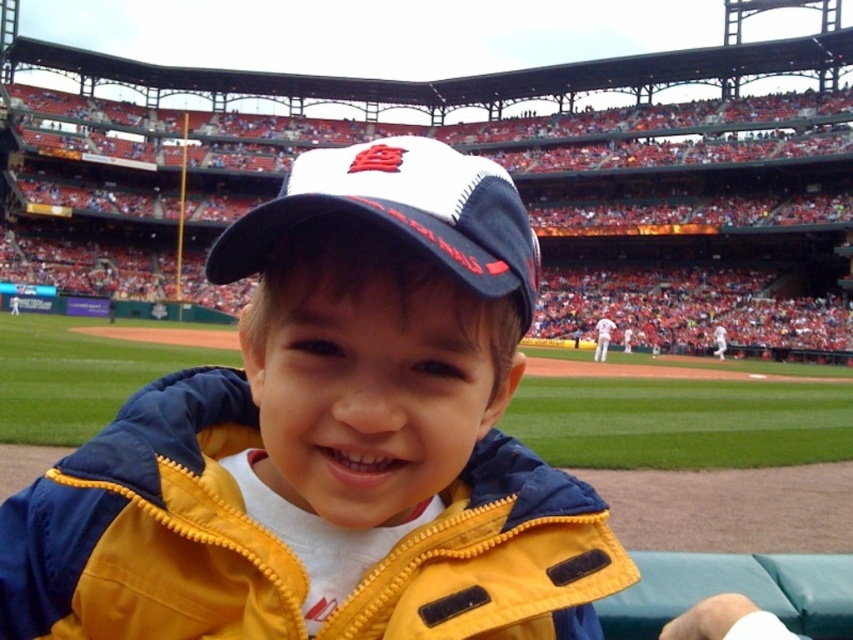
You are standing at the center of the baseball stadium and want to reach the point marked at coordinates (193, 392). If your walking speed is 3 feet per second, how many seconds will it take you to reach that point?

The point marked at coordinates (193, 392) is 96.87 feet away from the viewer. At a walking speed of 3 feet per second, it would take approximately 32.3 seconds to reach that point.

You are a photographer at the baseball stadium and want to capture a photo of the child wearing the yellow quilted jacket at center and the white mesh cap at center. Based on their positions, which object is closer to the camera?

The yellow quilted jacket at center is below the white mesh cap at center, so the white mesh cap at center is closer to the camera.

You are a photographer trying to capture a clear photo of the white mesh cap at center. However, the yellow quilted jacket at center is blocking your view. Can you adjust your position to take the photo without moving the objects?

The yellow quilted jacket at center is in front of the white mesh cap at center, so you can move your position to the side or angle your camera to avoid the obstruction caused by the yellow quilted jacket at center.